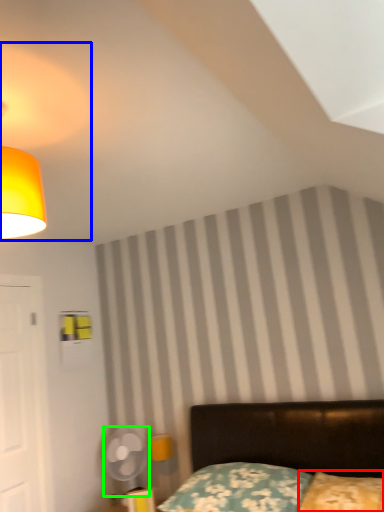
Question: Which object is the closest to the pillow (highlighted by a red box)? Choose among these: lamp (highlighted by a blue box) or mechanical fan (highlighted by a green box).

Choices:
 (A) lamp
 (B) mechanical fan

Answer: (B)